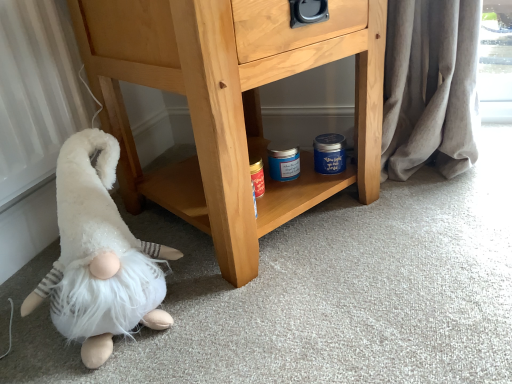
Where is `free spot in front of light brown wood chest of drawers at center`? free spot in front of light brown wood chest of drawers at center is located at coordinates (319, 309).